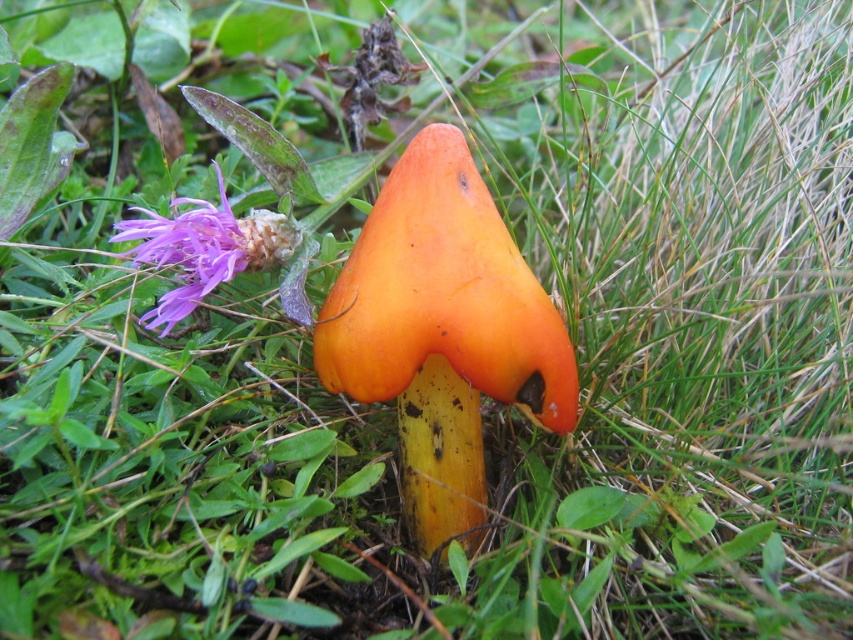
You are standing at the center of the grassy area and see the orange matte mushroom at center. If you walk straight ahead, will you reach the mushroom before walking 1 meter?

The position of orange matte mushroom at center is at point (444, 332), so the distance from the center to the mushroom is approximately 0.736 meters. Therefore, you will reach the orange matte mushroom at center before walking 1 meter.

You are a mycologist examining two orange mushrooms in the image. The first is the orange matte mushroom at center, and the second is the orange matte mushroom at upper left. Based on their positions, which one do you think has a larger cap width?

The orange matte mushroom at center might be wider than orange matte mushroom at upper left, so it likely has a larger cap width.

You are standing in a grassy area and see two orange matte mushrooms. One is at the center and the other is at the upper left. Which direction should you walk to go from the orange matte mushroom at upper left to the orange matte mushroom at center?

You should walk to the right to go from the orange matte mushroom at upper left to the orange matte mushroom at center since the orange matte mushroom at center is to the right of the orange matte mushroom at upper left.